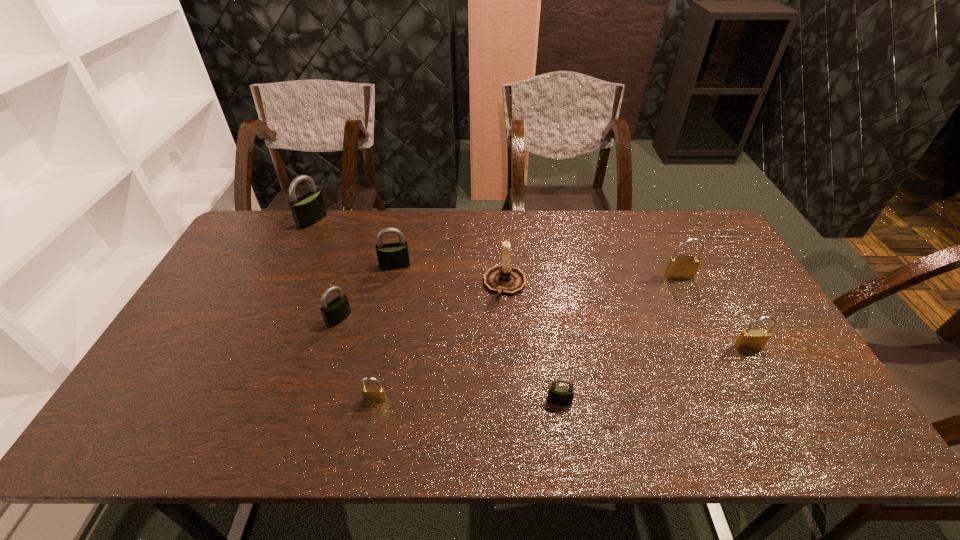
This screenshot has height=540, width=960. I want to click on the leftmost object, so click(x=307, y=210).

Where is `the tallest padlock`? The image size is (960, 540). the tallest padlock is located at coordinates (307, 210).

The width and height of the screenshot is (960, 540). In order to click on candle holder in this screenshot , I will do `click(502, 279)`.

Locate an element on the screen. The height and width of the screenshot is (540, 960). the fifth object from left to right is located at coordinates (502, 279).

You are a GUI agent. You are given a task and a screenshot of the screen. Output one action in this format:
    pyautogui.click(x=<x>, y=<y>)
    Task: Click on the second brass padlock from left to right
    The image size is (960, 540).
    Given the screenshot: What is the action you would take?
    pyautogui.click(x=679, y=267)

Where is `the fifth nearest padlock`? The image size is (960, 540). the fifth nearest padlock is located at coordinates (679, 267).

Find the location of a particular element. the second biggest black padlock is located at coordinates (392, 256).

Find the location of a particular element. The width and height of the screenshot is (960, 540). the second farthest padlock is located at coordinates (392, 256).

This screenshot has height=540, width=960. Find the location of `the second nearest black padlock`. the second nearest black padlock is located at coordinates (336, 311).

Image resolution: width=960 pixels, height=540 pixels. What are the coordinates of `the third black padlock from right to left` in the screenshot? It's located at (336, 311).